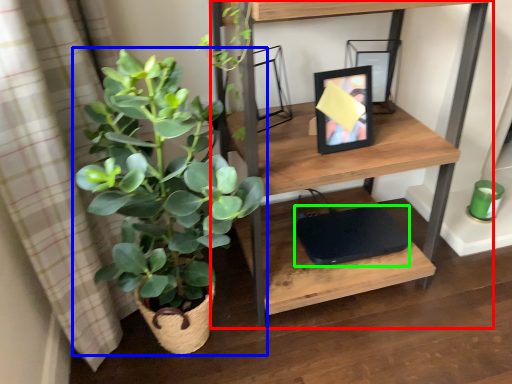
Question: Which is nearer to the shelf (highlighted by a red box)? houseplant (highlighted by a blue box) or computer (highlighted by a green box).

Choices:
 (A) houseplant
 (B) computer

Answer: (A)